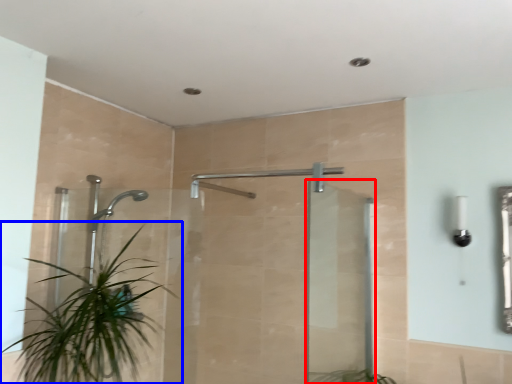
Question: Which object is closer to the camera taking this photo, screen door (highlighted by a red box) or houseplant (highlighted by a blue box)?

Choices:
 (A) screen door
 (B) houseplant

Answer: (B)